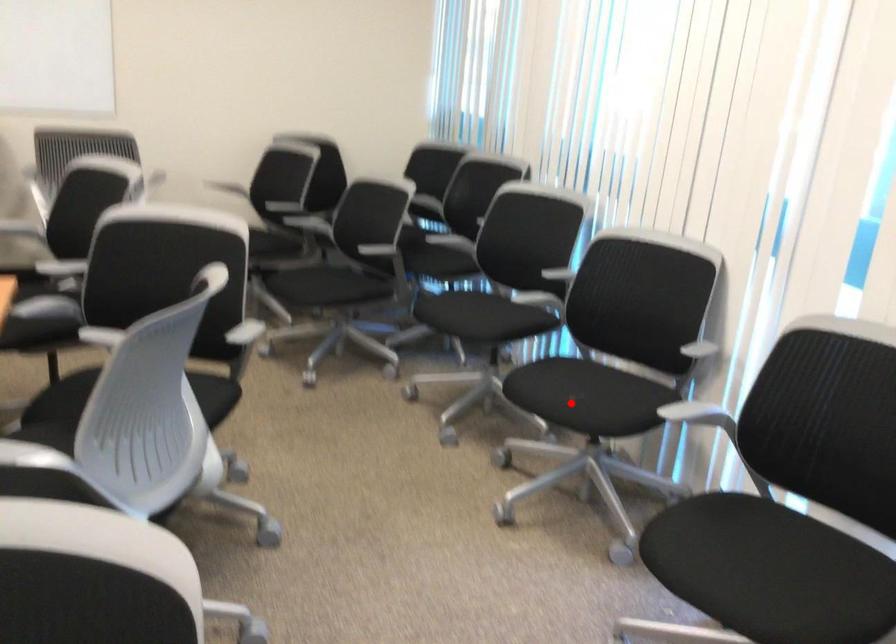
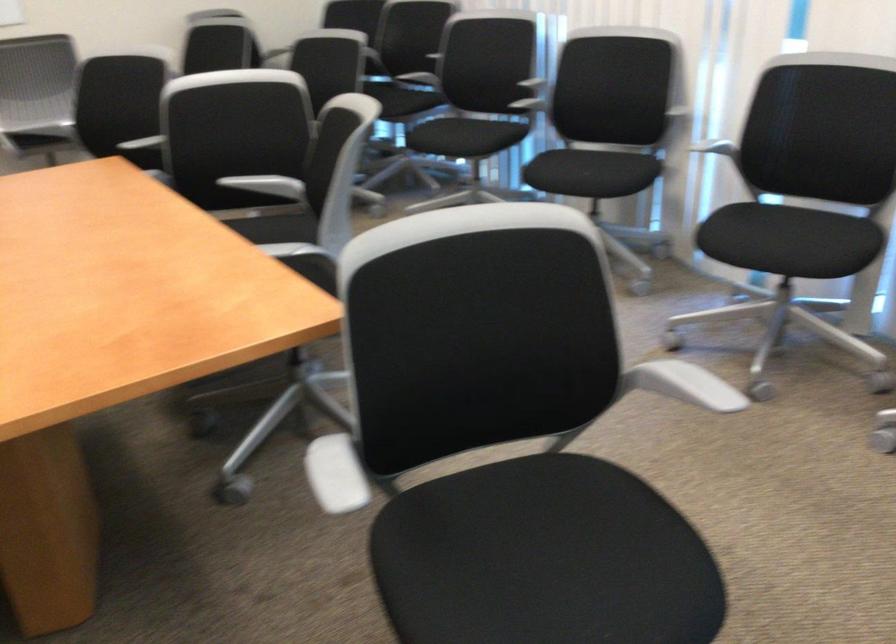
Question: A red point is marked in image1. In image2, is the corresponding 3D point closer to the camera or farther? Reply with the corresponding letter.

Choices:
 (A) The corresponding 3D point is closer.
 (B) The corresponding 3D point is farther.

Answer: (B)